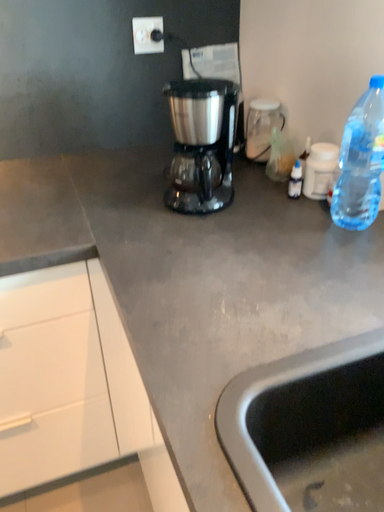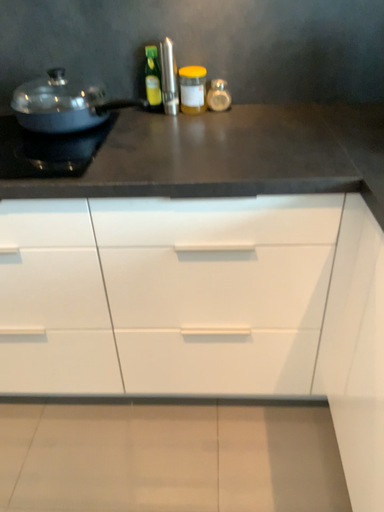
Question: How did the camera likely rotate when shooting the video?

Choices:
 (A) rotated right
 (B) rotated left

Answer: (B)